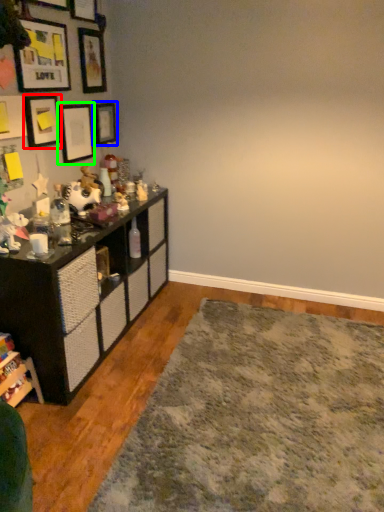
Question: Which object is the farthest from picture frame (highlighted by a red box)? Choose among these: picture frame (highlighted by a blue box) or picture frame (highlighted by a green box).

Choices:
 (A) picture frame
 (B) picture frame

Answer: (A)